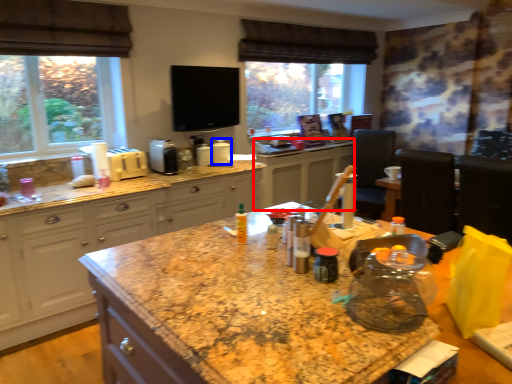
Question: Which point is closer to the camera, counter (highlighted by a red box) or appliance (highlighted by a blue box)?

Choices:
 (A) counter
 (B) appliance

Answer: (B)